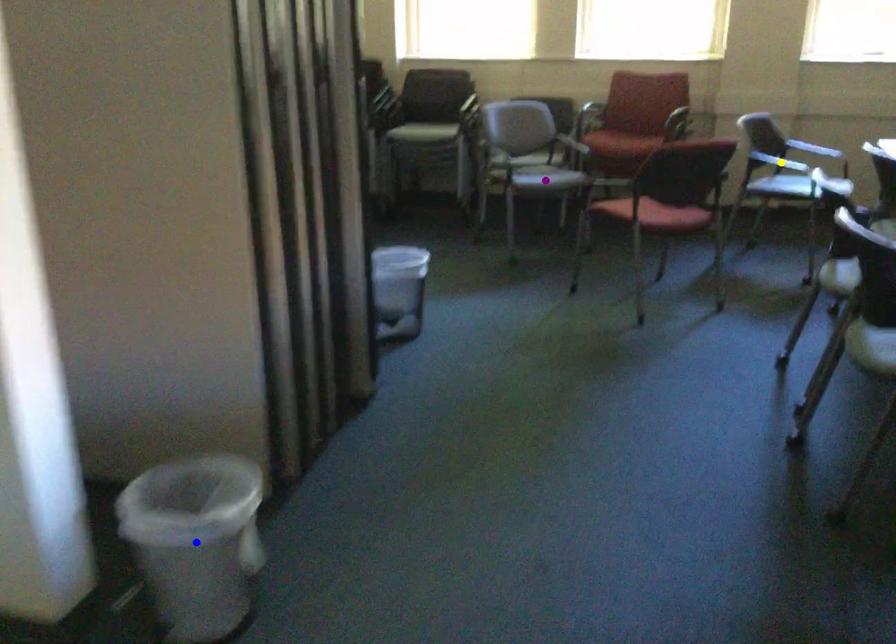
Order these from nearest to farthest:
1. purple point
2. blue point
3. yellow point

1. blue point
2. purple point
3. yellow point